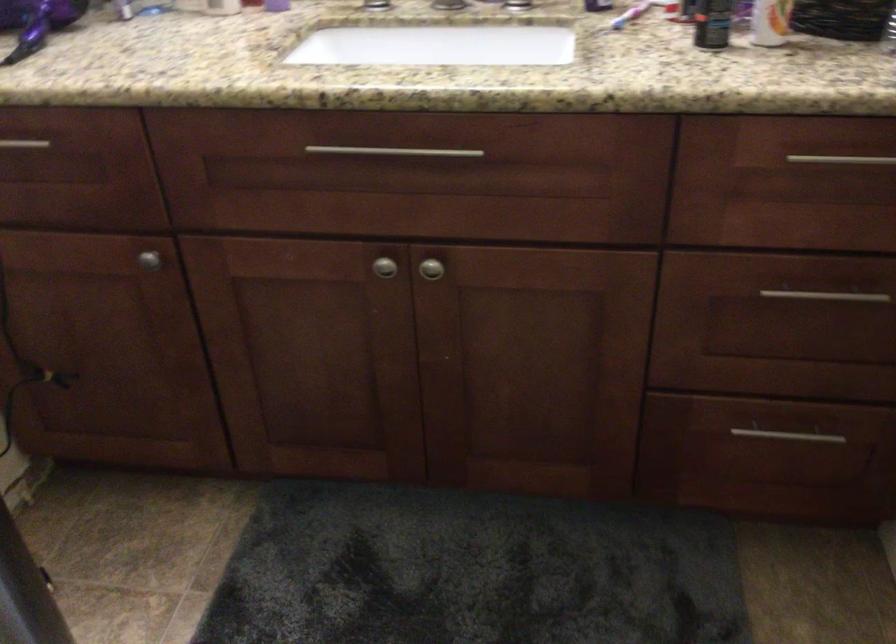
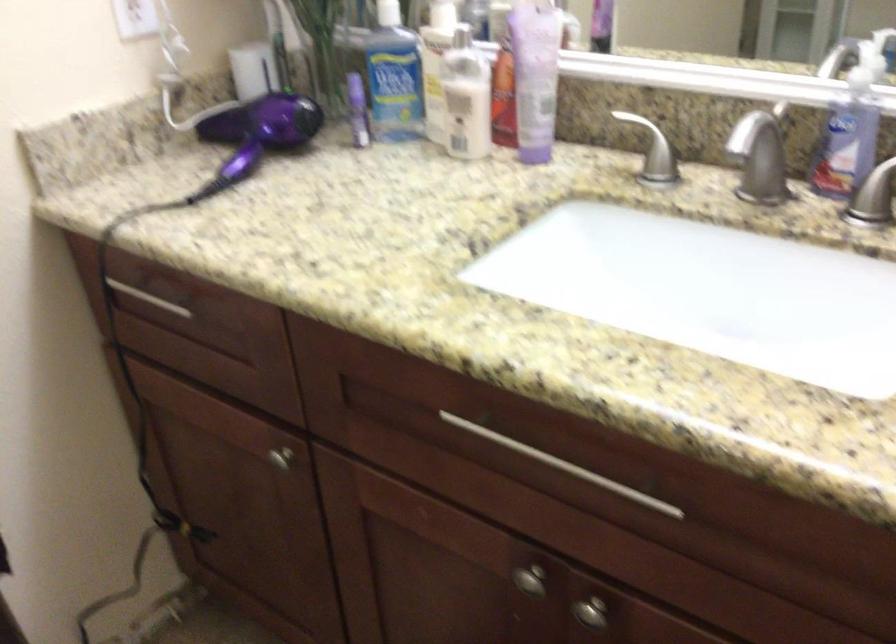
The point at (390, 267) is marked in the first image. Where is the corresponding point in the second image?

(530, 580)